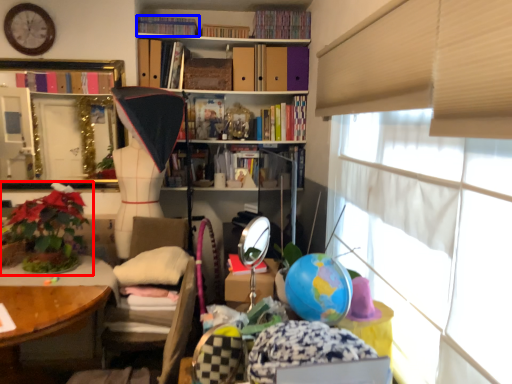
Question: Which object appears farthest to the camera in this image, houseplant (highlighted by a red box) or book (highlighted by a blue box)?

Choices:
 (A) houseplant
 (B) book

Answer: (B)